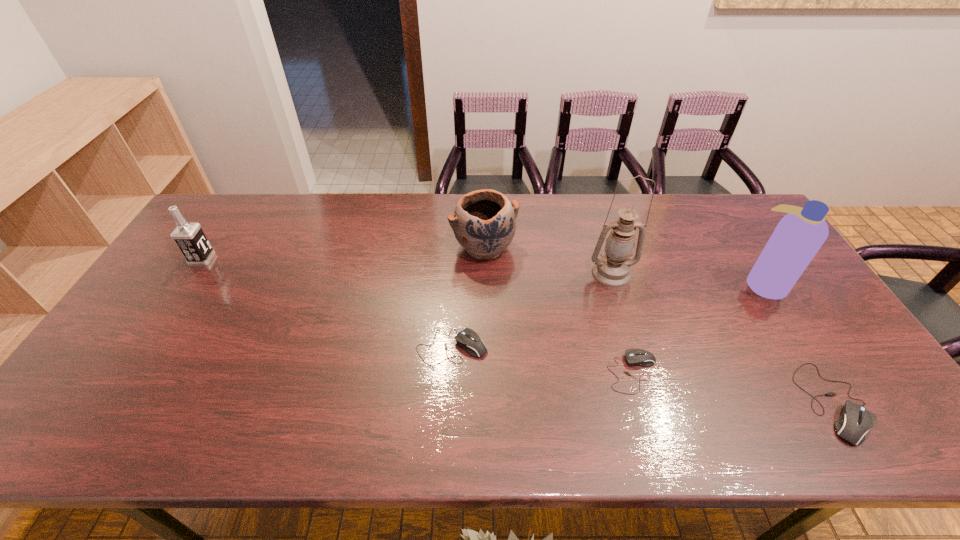
Considering the uniform spacing of computer mouses, where should an additional computer mouse be positioned on the left? Please locate a free spot. Please provide its 2D coordinates. Your answer should be formatted as a tuple, i.e. [(x, y)], where the tuple contains the x and y coordinates of a point satisfying the conditions above.

[(287, 323)]